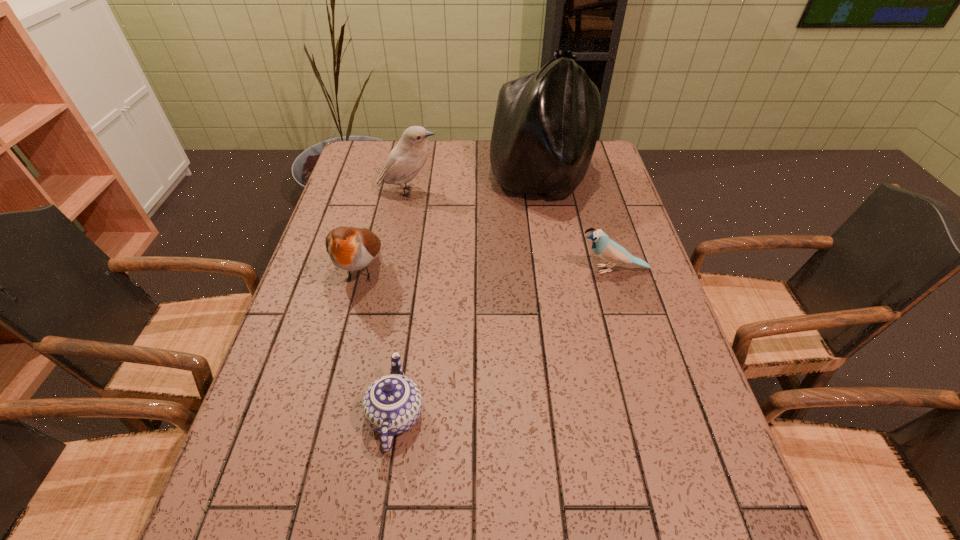
I want to click on free region that satisfies the following two spatial constraints: 1. at the face of the fourth tallest object; 2. at the face of the third shortest object, so click(613, 270).

Find the location of a particular element. The image size is (960, 540). free spot that satisfies the following two spatial constraints: 1. at the spout of the nearest object; 2. on the right side of the tallest object is located at coordinates (429, 181).